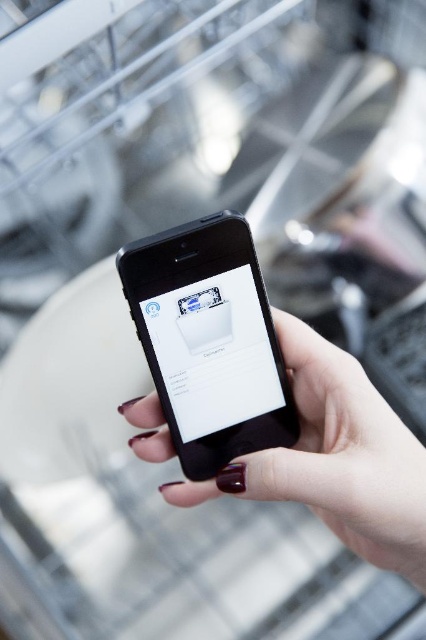
Looking at this image, is black glossy phone at center thinner than black matte phone at center?

Yes.

Can you confirm if black glossy phone at center is taller than black matte phone at center?

Incorrect, black glossy phone at center's height is not larger of black matte phone at center's.

Image resolution: width=426 pixels, height=640 pixels. I want to click on black glossy phone at center, so click(x=210, y=340).